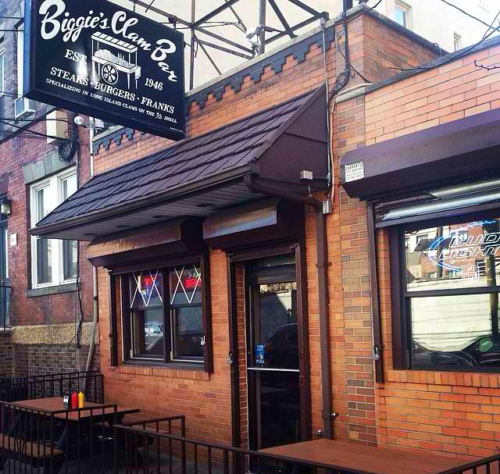
The image size is (500, 474). Identify the location of brick walls. (203, 397), (423, 420).